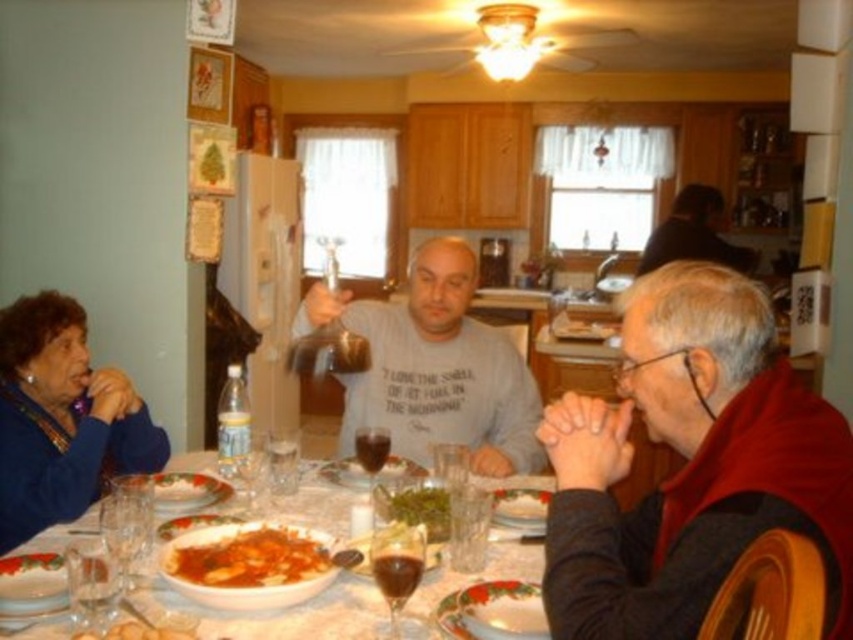
Who is more forward, (445, 614) or (173, 493)?

Positioned in front is point (445, 614).

Between porcelain plate at center and white frosted cake at center, which one appears on the left side from the viewer's perspective?

From the viewer's perspective, white frosted cake at center appears more on the left side.

Is point (540, 636) less distant than point (177, 481)?

Yes, point (540, 636) is closer to viewer.

Where is `porcelain plate at center`? The width and height of the screenshot is (853, 640). porcelain plate at center is located at coordinates (492, 611).

Which is above, white creamy cake at center or golden crispy pastry at lower center?

white creamy cake at center is above.

From the picture: Between white creamy cake at center and golden crispy pastry at lower center, which one appears on the right side from the viewer's perspective?

Positioned to the right is white creamy cake at center.

Who is more forward, (x=500, y=512) or (x=183, y=632)?

Positioned in front is point (x=183, y=632).

Locate an element on the screen. This screenshot has height=640, width=853. white creamy cake at center is located at coordinates (520, 502).

Locate an element on the screen. The width and height of the screenshot is (853, 640). dark gray sweater at center is located at coordinates (694, 234).

Between dark gray sweater at center and translucent glass wine at center, which one has less height?

Standing shorter between the two is translucent glass wine at center.

Locate an element on the screen. The width and height of the screenshot is (853, 640). dark gray sweater at center is located at coordinates (694, 234).